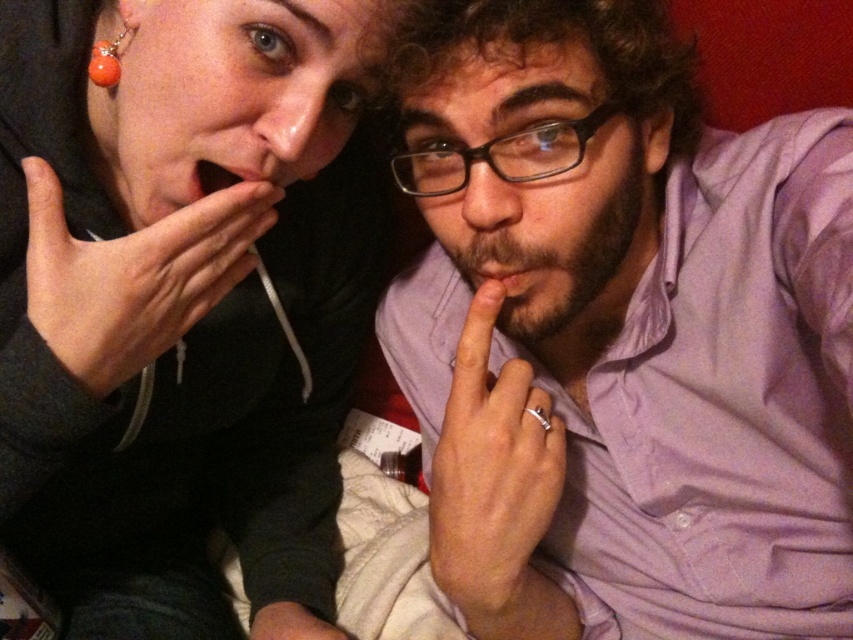
Question: In this image, where is purple cotton shirt at center located relative to matte black hand at upper left?

Choices:
 (A) left
 (B) right

Answer: (B)

Question: Considering the real-world distances, which object is closest to the black plastic glasses at center?

Choices:
 (A) purple cotton shirt at center
 (B) matte black mouth at center
 (C) beardsoft hair at center

Answer: (C)

Question: Among these objects, which one is farthest from the camera?

Choices:
 (A) silver metallic ring at center
 (B) orange glass bead at upper left
 (C) black plastic glasses at center
 (D) matte black hand at lower center

Answer: (D)

Question: Which object is the farthest from the matte black hoodie at upper left?

Choices:
 (A) black plastic glasses at center
 (B) purple cotton shirt at center
 (C) matte black hand at upper left

Answer: (A)

Question: Can you confirm if silver metallic ring at center is positioned to the left of orange glass bead at upper left?

Choices:
 (A) yes
 (B) no

Answer: (B)

Question: Is beardsoft hair at center below matte black mouth at center?

Choices:
 (A) no
 (B) yes

Answer: (B)